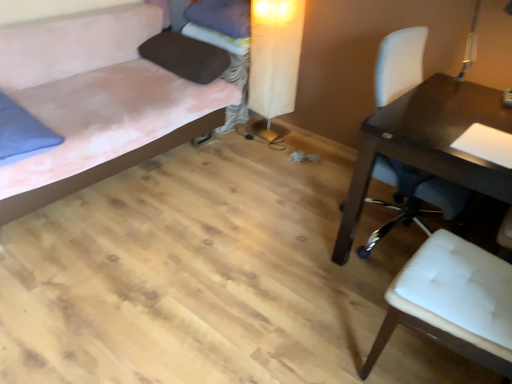
Locate an element on the screen. The width and height of the screenshot is (512, 384). vacant region to the left of white leather chair at right, which is counted as the 2th chair, starting from the back is located at coordinates (322, 336).